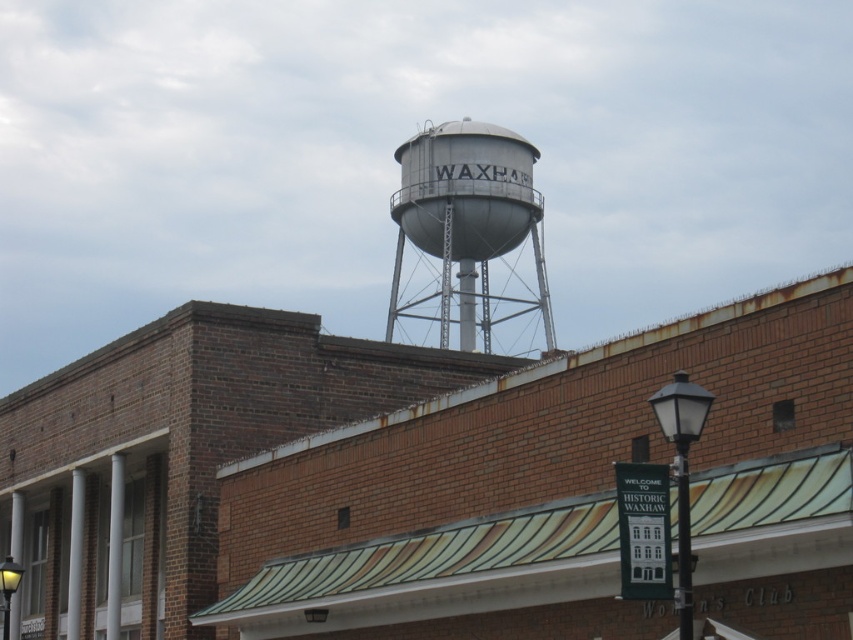
You are standing in front of the brick building and want to take a photo of the white metal water tower at upper center. If you move 0.1 units to the right, will the water tower still be in the center of your view?

The white metal water tower at upper center is located at point (425,481). Moving 0.1 units to the right would shift your position, but since the tower is already at the upper center, it would likely remain in the center of your view unless the movement significantly alters the frame. However, without knowing the field of view or camera angle, it is difficult to determine precisely. However, based on the coordinates, moving right by 0.1 units might shift the tower slightly to the left in your view, but 0

You are an architect examining the building with a white metal water tower at upper center and a silver metallic water tower at upper center. Which one appears closer to you based on their positions?

The white metal water tower at upper center appears closer because it is in front of the silver metallic water tower at upper center.